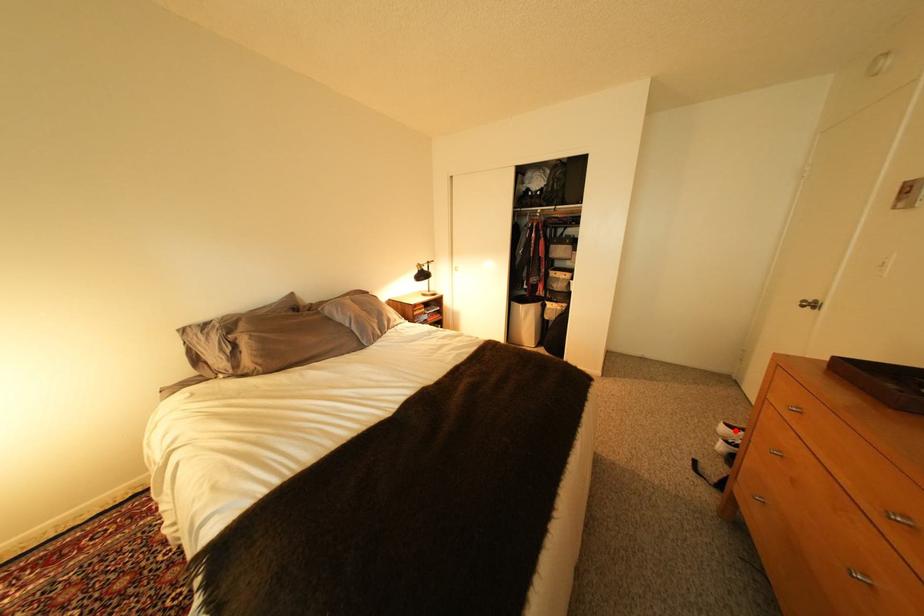
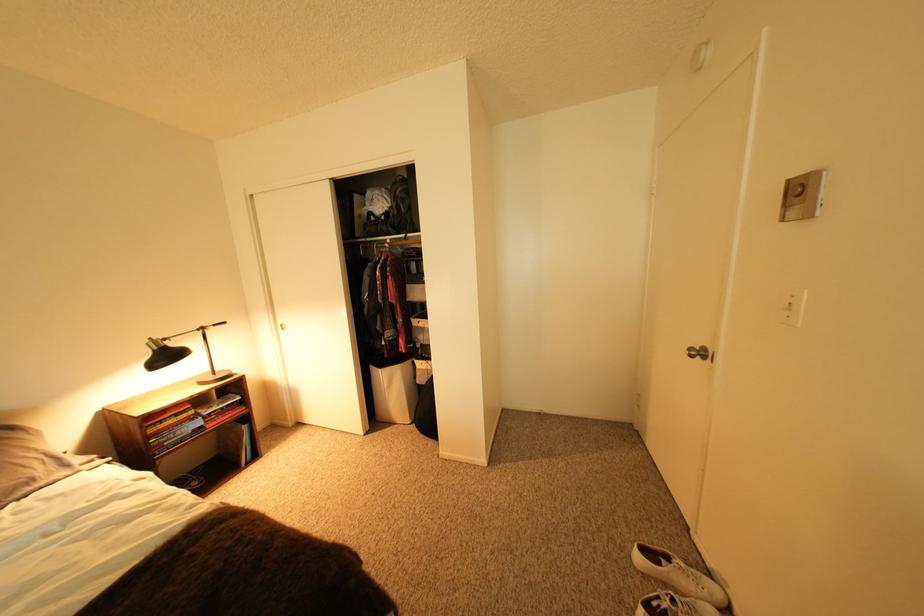
Question: I am providing you with two images of the same scene from different viewpoints. Image1 has a red point marked. In image2, the corresponding 3D location appears at what relative position? Reply with the corresponding letter.

Choices:
 (A) Closer
 (B) Farther

Answer: (B)